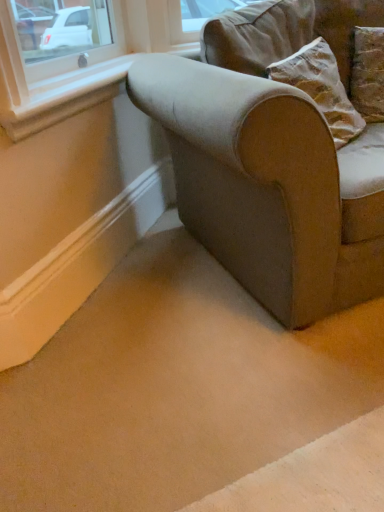
Question: Is the position of white smooth window sill at upper left more distant than that of velvet-like beige couch at center?

Choices:
 (A) no
 (B) yes

Answer: (B)

Question: Can we say white smooth window sill at upper left lies outside velvet-like beige couch at center?

Choices:
 (A) yes
 (B) no

Answer: (A)

Question: From the image's perspective, is white smooth window sill at upper left on top of velvet-like beige couch at center?

Choices:
 (A) no
 (B) yes

Answer: (B)

Question: Is white smooth window sill at upper left facing towards velvet-like beige couch at center?

Choices:
 (A) no
 (B) yes

Answer: (B)

Question: From the image's perspective, is white smooth window sill at upper left under velvet-like beige couch at center?

Choices:
 (A) no
 (B) yes

Answer: (A)

Question: Considering the relative positions of white smooth window sill at upper left and velvet-like beige couch at center in the image provided, is white smooth window sill at upper left to the left of velvet-like beige couch at center from the viewer's perspective?

Choices:
 (A) no
 (B) yes

Answer: (B)

Question: Is velvet-like beige couch at center shorter than white smooth window sill at upper left?

Choices:
 (A) yes
 (B) no

Answer: (B)

Question: From the image's perspective, is velvet-like beige couch at center beneath white smooth window sill at upper left?

Choices:
 (A) no
 (B) yes

Answer: (B)

Question: From a real-world perspective, is velvet-like beige couch at center physically below white smooth window sill at upper left?

Choices:
 (A) yes
 (B) no

Answer: (A)

Question: Does velvet-like beige couch at center come in front of white smooth window sill at upper left?

Choices:
 (A) no
 (B) yes

Answer: (B)

Question: Is velvet-like beige couch at center to the left of white smooth window sill at upper left from the viewer's perspective?

Choices:
 (A) no
 (B) yes

Answer: (A)

Question: Does velvet-like beige couch at center have a smaller size compared to white smooth window sill at upper left?

Choices:
 (A) no
 (B) yes

Answer: (A)

Question: Is point (243, 129) positioned closer to the camera than point (21, 131)?

Choices:
 (A) closer
 (B) farther

Answer: (A)